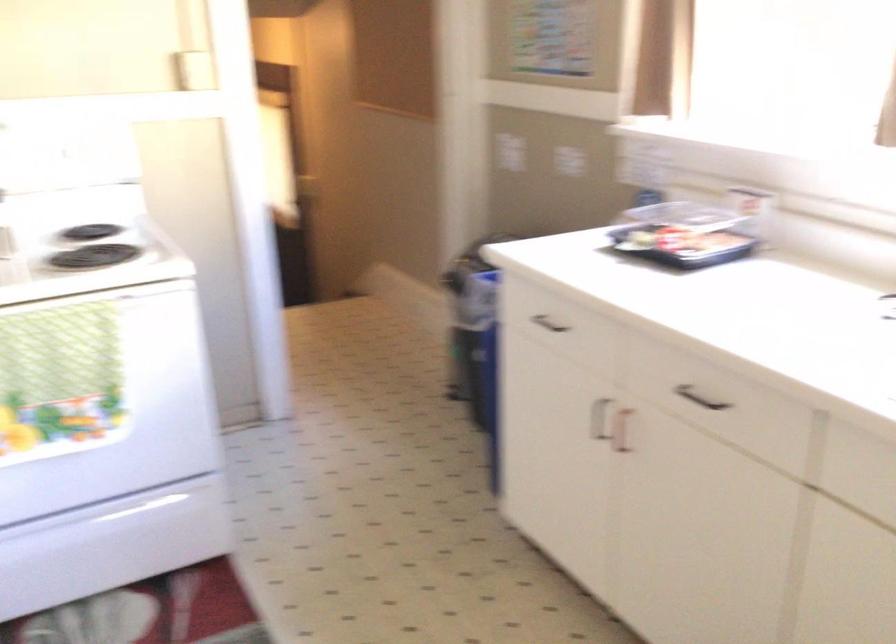
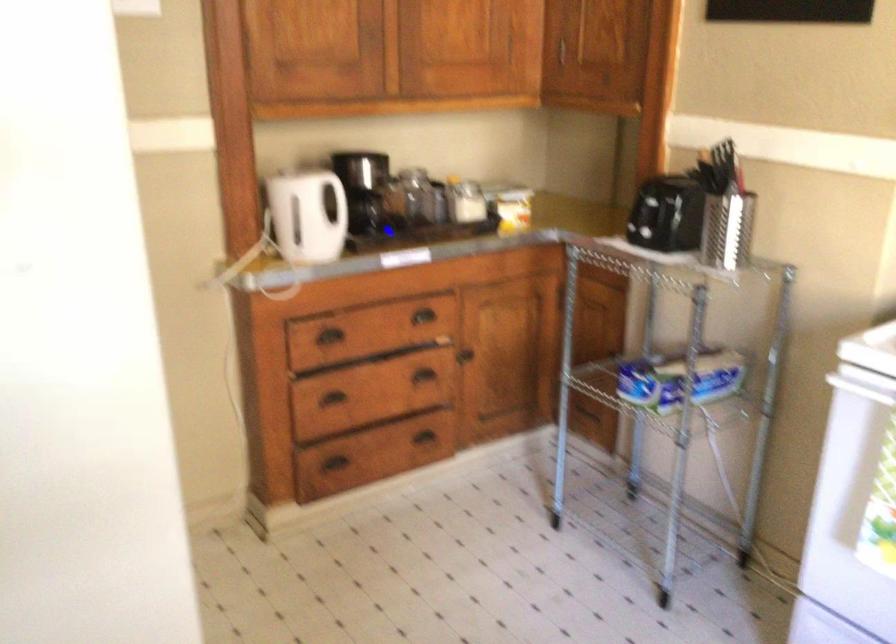
Based on the continuous images, in which direction is the camera rotating?

The rotation direction of the camera is left-down.